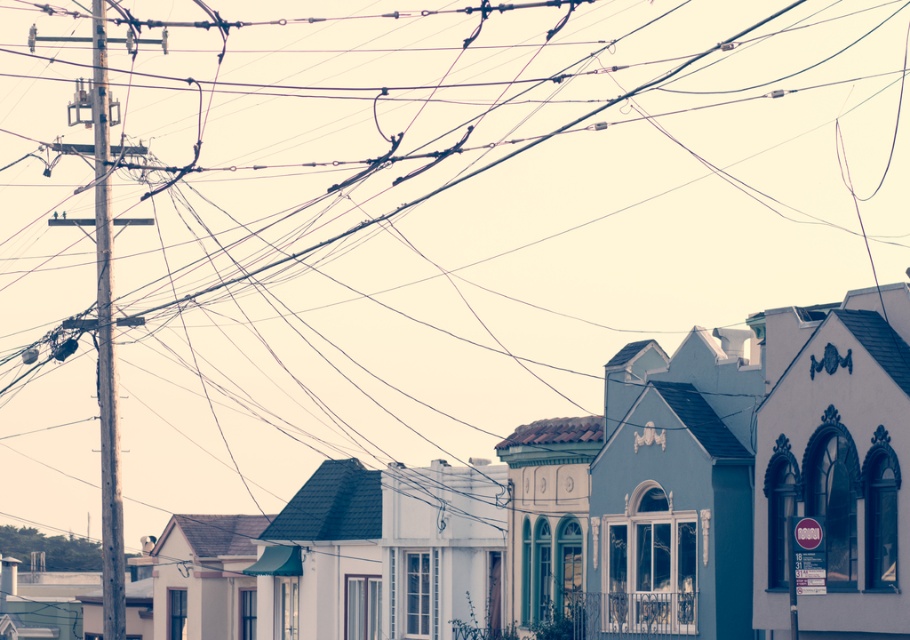
Question: Which point appears farthest from the camera in this image?

Choices:
 (A) (103, 544)
 (B) (604, 448)

Answer: (B)

Question: Can you confirm if white matte building at center is positioned to the left of wooden telegraph pole at left?

Choices:
 (A) yes
 (B) no

Answer: (B)

Question: Where is white matte building at center located in relation to wooden telegraph pole at left in the image?

Choices:
 (A) below
 (B) above

Answer: (B)

Question: Does white matte building at center come behind wooden telegraph pole at left?

Choices:
 (A) no
 (B) yes

Answer: (A)

Question: Among these points, which one is nearest to the camera?

Choices:
 (A) (110, 374)
 (B) (737, 499)

Answer: (B)